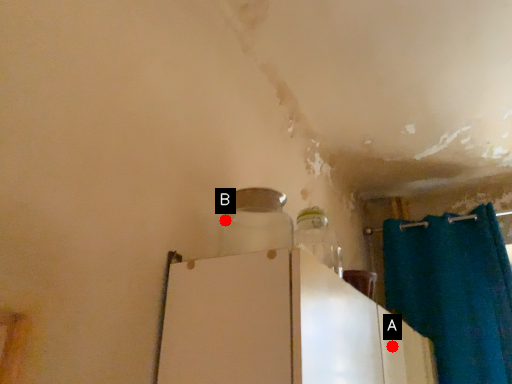
Question: Two points are circled on the image, labeled by A and B beside each circle. Which point is farther from the camera taking this photo?

Choices:
 (A) A is further
 (B) B is further

Answer: (A)